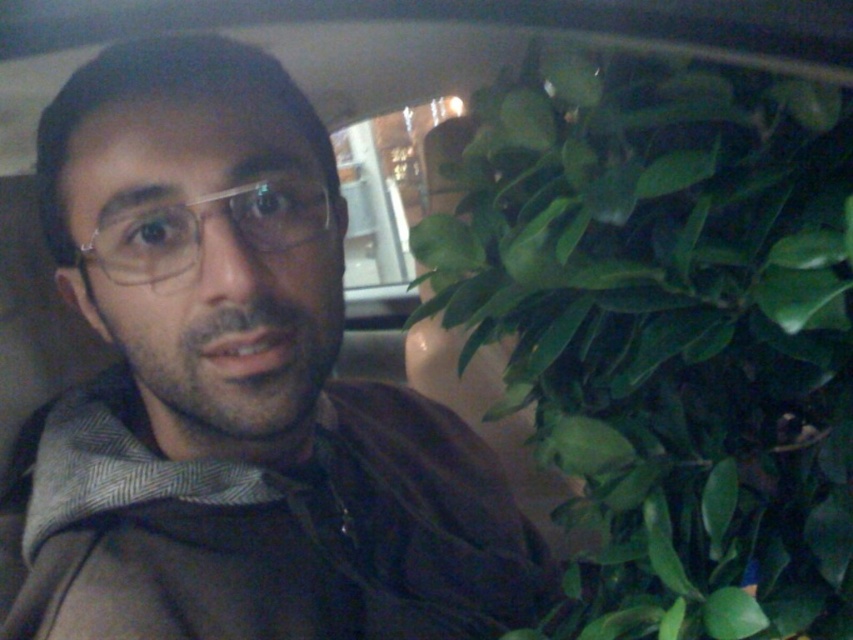
Is brown fabric at center bigger than green matte leafy plant at right?

Correct, brown fabric at center is larger in size than green matte leafy plant at right.

Between brown fabric at center and green matte leafy plant at right, which one is positioned lower?

brown fabric at center is below.

Where is `brown fabric at center`? brown fabric at center is located at coordinates (234, 392).

You are a GUI agent. You are given a task and a screenshot of the screen. Output one action in this format:
    pyautogui.click(x=<x>, y=<y>)
    Task: Click on the brown fabric at center
    The height and width of the screenshot is (640, 853).
    Given the screenshot: What is the action you would take?
    pyautogui.click(x=234, y=392)

Does green matte leafy plant at right have a lesser height compared to clear plastic glasses at center?

No.

Find the location of `green matte leafy plant at right`. green matte leafy plant at right is located at coordinates (663, 330).

Can you confirm if brown fabric at center is smaller than clear plastic glasses at center?

No, brown fabric at center is not smaller than clear plastic glasses at center.

Can you confirm if brown fabric at center is wider than clear plastic glasses at center?

Indeed, brown fabric at center has a greater width compared to clear plastic glasses at center.

The image size is (853, 640). I want to click on brown fabric at center, so click(x=234, y=392).

The width and height of the screenshot is (853, 640). In order to click on brown fabric at center in this screenshot , I will do `click(234, 392)`.